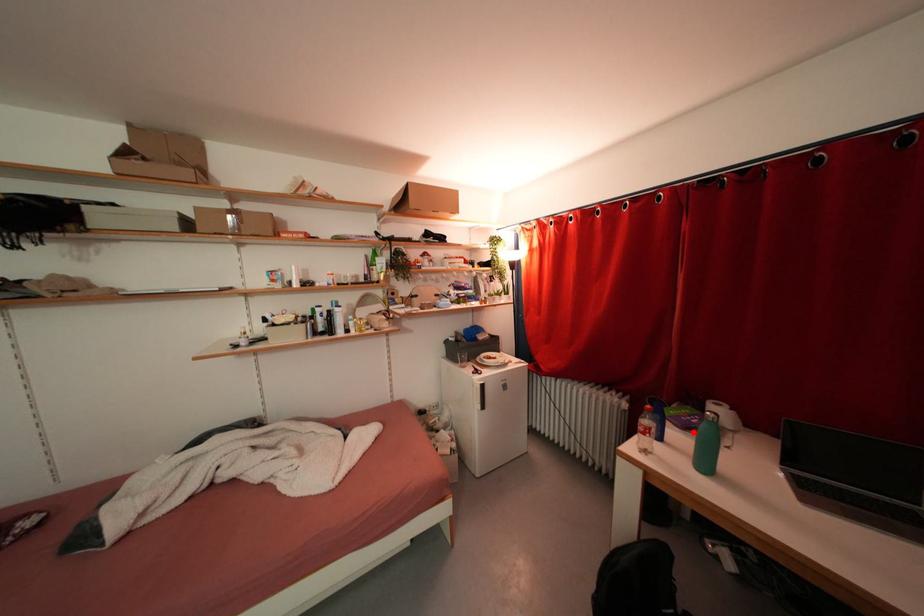
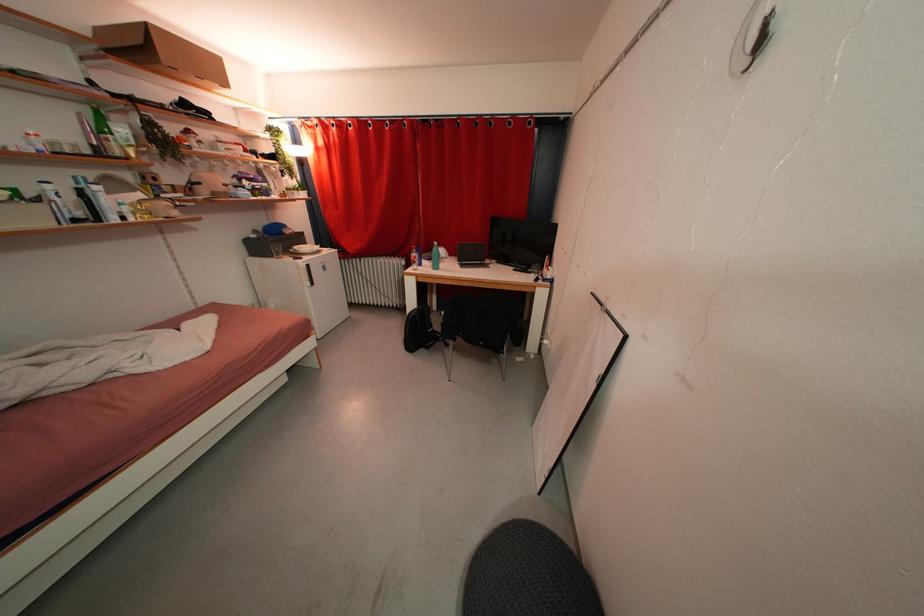
Locate, in the second image, the point that corresponds to the highlighted location in the first image.

(435, 262)